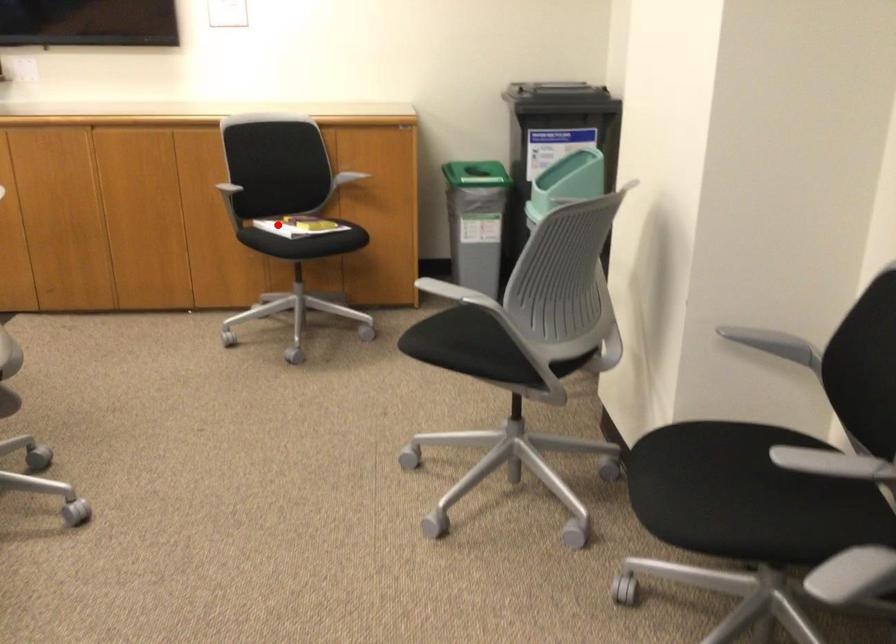
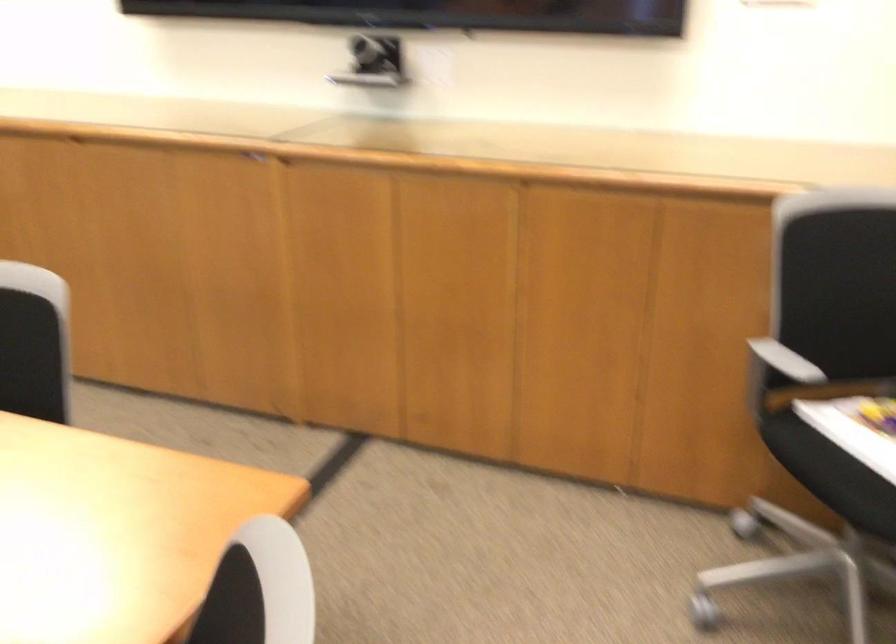
Question: A red point is marked in image1. In image2, is the corresponding 3D point closer to the camera or farther? Reply with the corresponding letter.

Choices:
 (A) The corresponding 3D point is closer.
 (B) The corresponding 3D point is farther.

Answer: (A)